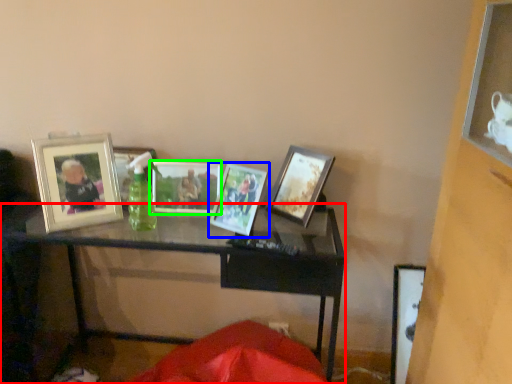
Question: Based on their relative distances, which object is nearer to table (highlighted by a red box)? Choose from picture frame (highlighted by a blue box) and picture frame (highlighted by a green box).

Choices:
 (A) picture frame
 (B) picture frame

Answer: (B)